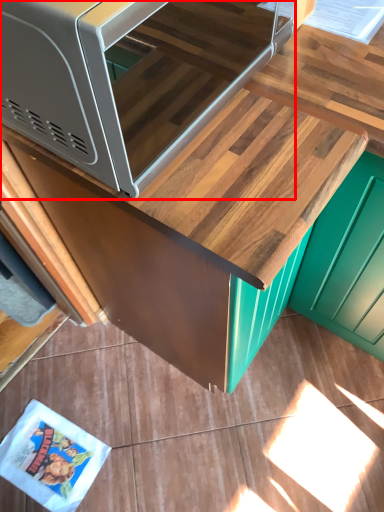
Question: In this image, where is microwave (annotated by the red box) located relative to cabinetry?

Choices:
 (A) left
 (B) right

Answer: (A)